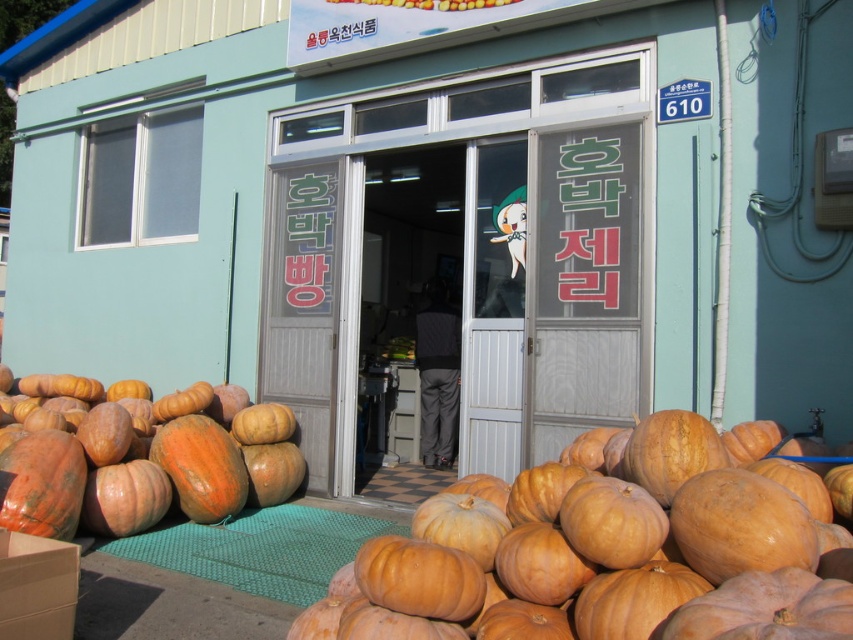
You are a delivery person trying to deliver a package to the shop. The package is too large to fit through the smooth glass door at center. Can you place it on top of the orange matte pumpkin at lower center?

The smooth glass door at center is taller than the orange matte pumpkin at lower center, so the pumpkin is shorter. Since the package is too large for the door, it might not fit on the pumpkin either, but the pumpkin is shorter than the door. However, the exact dimensions of the package aren

You are a delivery person trying to deliver a package to the shop. The package is too large to fit through the entrance. Based on the scene, which object takes up more space, the smooth glass door at center or the orange matte pumpkin at lower center?

The orange matte pumpkin at lower center takes up more space than the smooth glass door at center, so the package might be too large to fit through the entrance.

You are a customer standing in front of the shop and want to pick up both the orange matte pumpkin at lower center and the orange matte pumpkin at center. Which pumpkin is located to the right of the other?

The orange matte pumpkin at lower center is positioned on the right side of orange matte pumpkin at center.